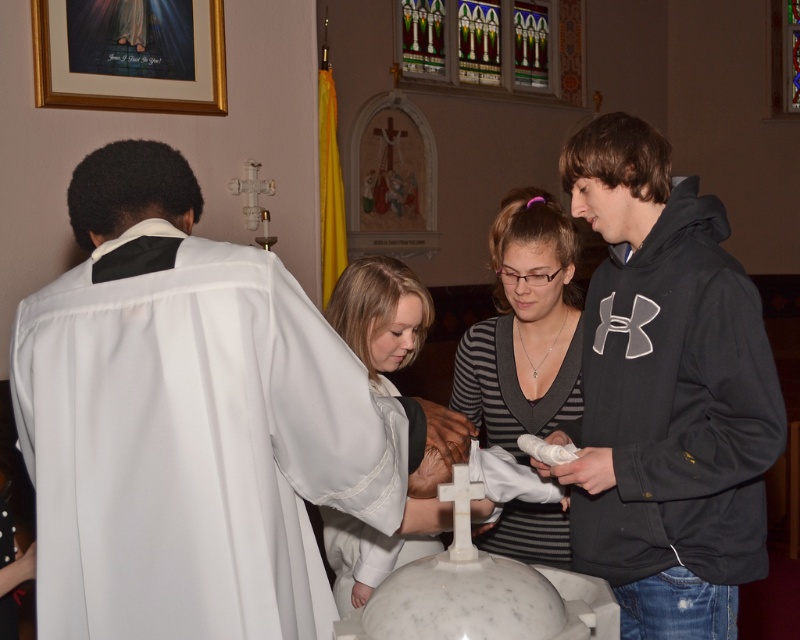
Is point (244, 552) less distant than point (646, 296)?

That is True.

Which is above, white silk robe at left or black hoodie at center?

black hoodie at center

Does point (58, 593) come behind point (620, 232)?

That is False.

Locate an element on the screen. Image resolution: width=800 pixels, height=640 pixels. white silk robe at left is located at coordinates (192, 442).

Which is more to the left, black hoodie at center or white satin robe at center?

white satin robe at center

Between black hoodie at center and white satin robe at center, which one has less height?

Standing shorter between the two is white satin robe at center.

The image size is (800, 640). I want to click on black hoodie at center, so click(666, 394).

The height and width of the screenshot is (640, 800). Find the location of `black hoodie at center`. black hoodie at center is located at coordinates (666, 394).

Can you confirm if white silk robe at left is shorter than white matte cross at center?

In fact, white silk robe at left may be taller than white matte cross at center.

Does white silk robe at left lie behind white matte cross at center?

No, white silk robe at left is in front of white matte cross at center.

Locate an element on the screen. Image resolution: width=800 pixels, height=640 pixels. white silk robe at left is located at coordinates (192, 442).